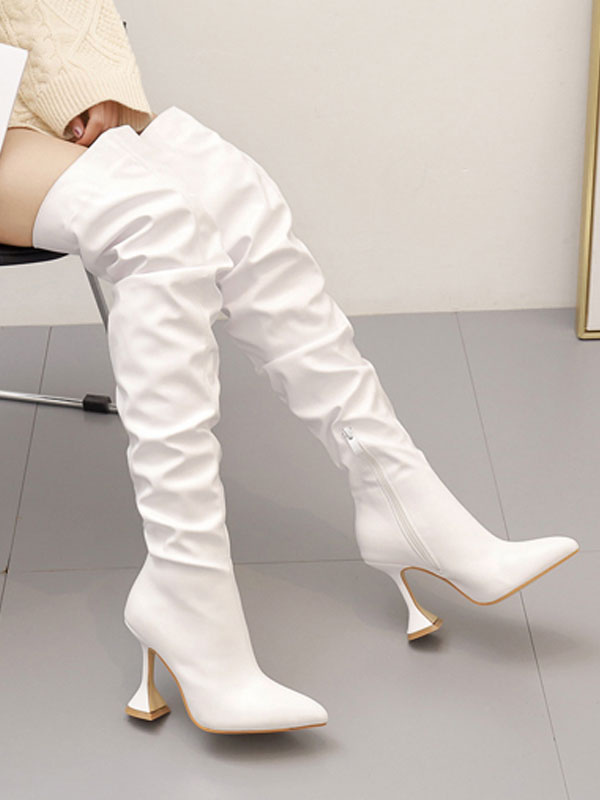
You are a GUI agent. You are given a task and a screenshot of the screen. Output one action in this format:
    pyautogui.click(x=<x>, y=<y>)
    Task: Click on the white mat part of picture frame
    
    Given the screenshot: What is the action you would take?
    point(591,308)